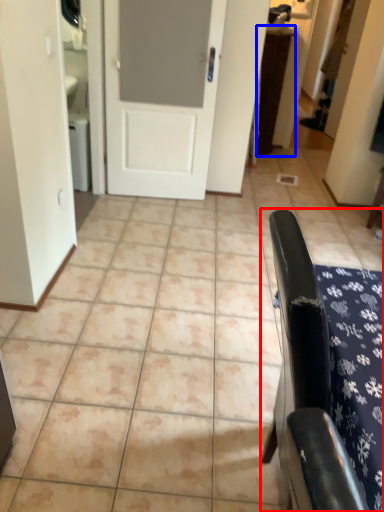
Question: Among these objects, which one is farthest to the camera, furniture (highlighted by a red box) or table (highlighted by a blue box)?

Choices:
 (A) furniture
 (B) table

Answer: (B)